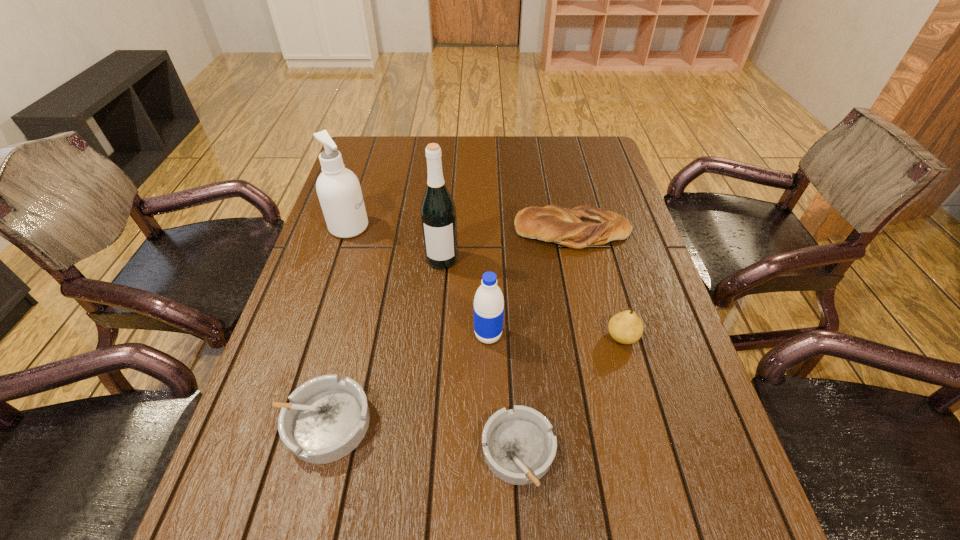
At what (x,y) coordinates should I click in order to perform the action: click on free point between the shortest object and the water bottle. Please return your answer as a coordinate pair (x, y). Image resolution: width=960 pixels, height=540 pixels. Looking at the image, I should click on (503, 394).

At what (x,y) coordinates should I click in order to perform the action: click on vacant space that is in between the right ashtray and the water bottle. Please return your answer as a coordinate pair (x, y). This screenshot has width=960, height=540. Looking at the image, I should click on (503, 394).

This screenshot has height=540, width=960. In order to click on vacant space that is in between the cleansing agent and the taller ashtray in this screenshot , I will do `click(337, 325)`.

The width and height of the screenshot is (960, 540). What are the coordinates of `object that is the fifth closest one to the fifth tallest object` in the screenshot? It's located at (519, 446).

You are a GUI agent. You are given a task and a screenshot of the screen. Output one action in this format:
    pyautogui.click(x=<x>, y=<y>)
    Task: Click on the object that is the nearest to the shorter ashtray
    
    Given the screenshot: What is the action you would take?
    pyautogui.click(x=488, y=306)

The width and height of the screenshot is (960, 540). I want to click on free spot that satisfies the following two spatial constraints: 1. on the front label of the cleansing agent; 2. on the back side of the third tallest object, so click(x=314, y=335).

Where is `vacant space that satisfies the following two spatial constraints: 1. on the back side of the right ashtray; 2. on the left side of the pear`? The width and height of the screenshot is (960, 540). vacant space that satisfies the following two spatial constraints: 1. on the back side of the right ashtray; 2. on the left side of the pear is located at coordinates (512, 337).

Where is `vacant region that satisfies the following two spatial constraints: 1. on the front label of the sixth shortest object; 2. on the back side of the third shortest object`? vacant region that satisfies the following two spatial constraints: 1. on the front label of the sixth shortest object; 2. on the back side of the third shortest object is located at coordinates (348, 232).

Where is `free space that satisfies the following two spatial constraints: 1. on the front label of the second tallest object; 2. on the right side of the water bottle`? The width and height of the screenshot is (960, 540). free space that satisfies the following two spatial constraints: 1. on the front label of the second tallest object; 2. on the right side of the water bottle is located at coordinates pos(314,335).